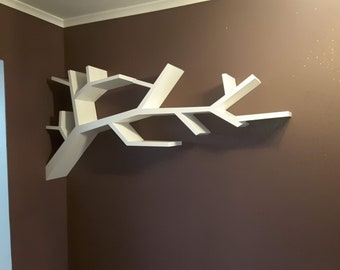
Image resolution: width=340 pixels, height=270 pixels. I want to click on decoration, so click(85, 138).